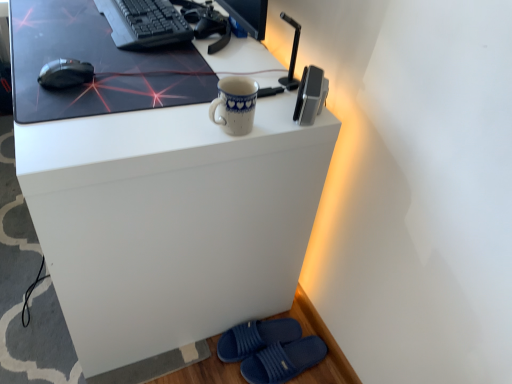
Question: Should I look upward or downward to see blue rubber slippers at lower right, which is the 1th footwear in bottom-to-top order?

Choices:
 (A) up
 (B) down

Answer: (B)

Question: Can you confirm if matte black mousepad at upper center is positioned to the right of satin silver speaker at upper right?

Choices:
 (A) yes
 (B) no

Answer: (B)

Question: Considering the relative positions of matte black mousepad at upper center and satin silver speaker at upper right in the image provided, is matte black mousepad at upper center to the left of satin silver speaker at upper right from the viewer's perspective?

Choices:
 (A) yes
 (B) no

Answer: (A)

Question: From a real-world perspective, is matte black mousepad at upper center over satin silver speaker at upper right?

Choices:
 (A) yes
 (B) no

Answer: (B)

Question: Is matte black mousepad at upper center in contact with satin silver speaker at upper right?

Choices:
 (A) no
 (B) yes

Answer: (A)

Question: Is matte black mousepad at upper center oriented away from satin silver speaker at upper right?

Choices:
 (A) no
 (B) yes

Answer: (A)

Question: Is matte black mousepad at upper center positioned far away from satin silver speaker at upper right?

Choices:
 (A) yes
 (B) no

Answer: (B)

Question: Can you confirm if black matte mouse at left is thinner than blue rubber slippers at lower right, marked as the second footwear in a top-to-bottom arrangement?

Choices:
 (A) no
 (B) yes

Answer: (B)

Question: Is the position of black matte mouse at left less distant than that of blue rubber slippers at lower right, which is the 1th footwear in bottom-to-top order?

Choices:
 (A) yes
 (B) no

Answer: (A)

Question: Is black matte mouse at left oriented towards blue rubber slippers at lower right, which is the 1th footwear in bottom-to-top order?

Choices:
 (A) yes
 (B) no

Answer: (B)

Question: Considering the relative sizes of black matte mouse at left and blue rubber slippers at lower right, marked as the second footwear in a top-to-bottom arrangement, in the image provided, is black matte mouse at left bigger than blue rubber slippers at lower right, marked as the second footwear in a top-to-bottom arrangement,?

Choices:
 (A) no
 (B) yes

Answer: (A)

Question: Would you say black matte mouse at left is outside blue rubber slippers at lower right, which is the 1th footwear in bottom-to-top order?

Choices:
 (A) no
 (B) yes

Answer: (B)

Question: Considering the relative sizes of black matte mouse at left and blue rubber slippers at lower right, marked as the second footwear in a top-to-bottom arrangement, in the image provided, is black matte mouse at left taller than blue rubber slippers at lower right, marked as the second footwear in a top-to-bottom arrangement,?

Choices:
 (A) yes
 (B) no

Answer: (B)

Question: Does blue rubber slippers at lower right, which is the 1th footwear in bottom-to-top order, have a smaller size compared to black matte keyboard at upper left?

Choices:
 (A) yes
 (B) no

Answer: (A)